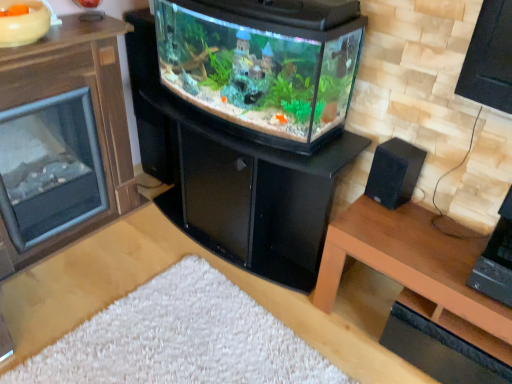
Question: From the image's perspective, is black matte speaker at right located above or below black glossy fireplace at center?

Choices:
 (A) above
 (B) below

Answer: (A)

Question: Based on their positions, is black matte speaker at right located to the left or right of black glossy fireplace at center?

Choices:
 (A) left
 (B) right

Answer: (B)

Question: Based on their relative distances, which object is nearer to the brown wood fireplace at left?

Choices:
 (A) brown wood table at lower right
 (B) black glossy fireplace at center
 (C) black matte speaker at right

Answer: (B)

Question: Considering the real-world distances, which object is farthest from the black matte speaker at right?

Choices:
 (A) brown wood table at lower right
 (B) brown wood fireplace at left
 (C) black glossy fireplace at center

Answer: (B)